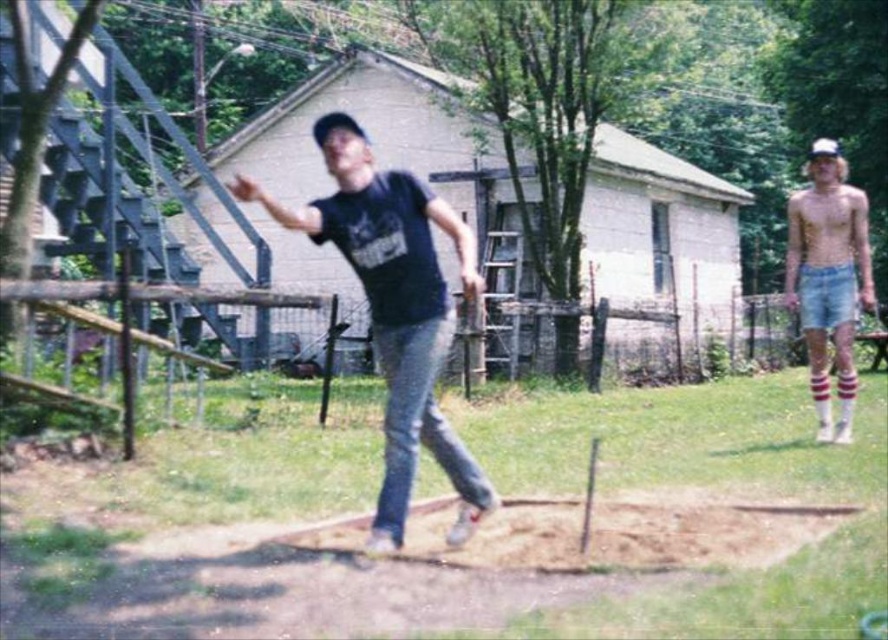
Can you confirm if matte black t-shirt at center is shorter than denim shorts at right?

Yes.

This screenshot has height=640, width=888. I want to click on matte black t-shirt at center, so click(395, 310).

Is point (342, 243) behind point (829, 406)?

That is False.

Locate an element on the screen. matte black t-shirt at center is located at coordinates (395, 310).